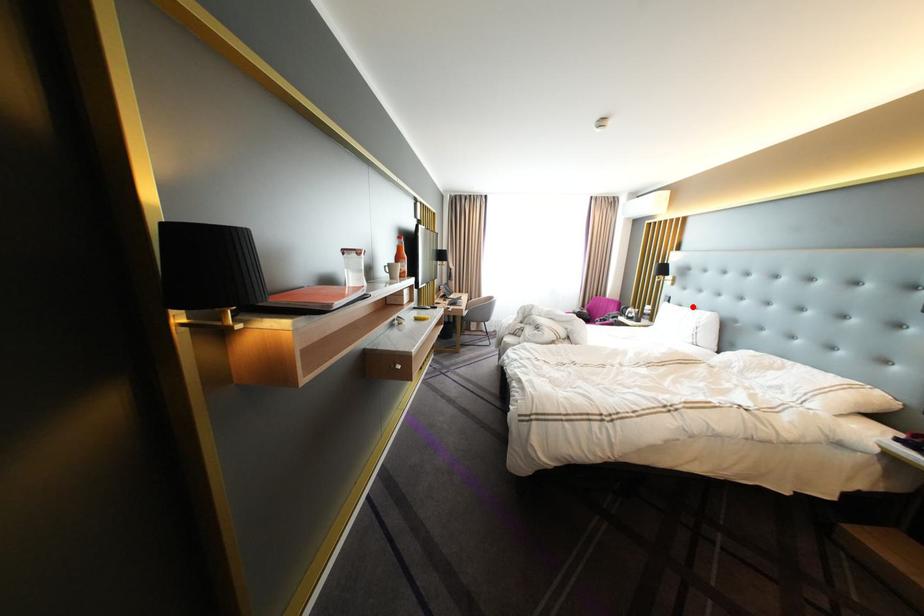
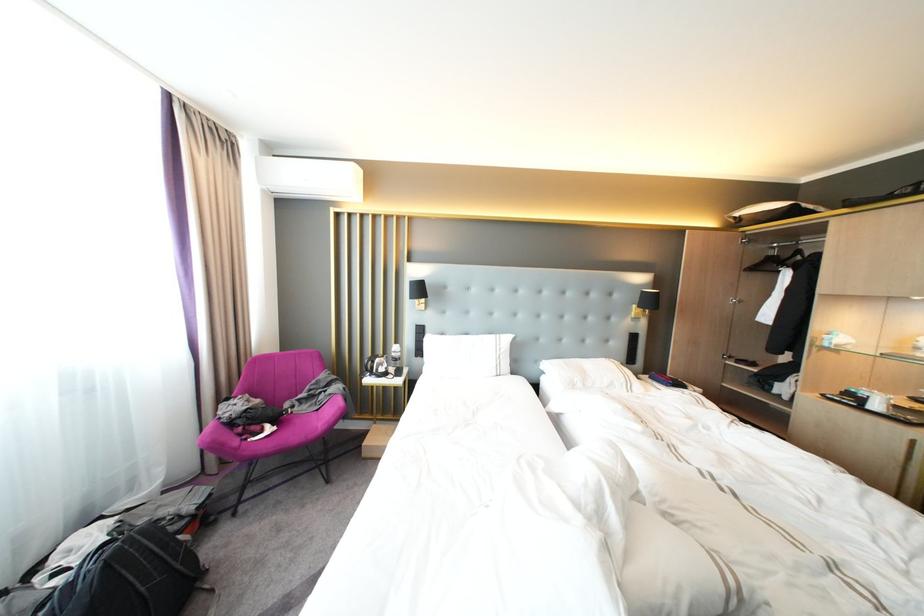
Where in the second image is the point corresponding to the highlighted location from the first image?

(455, 334)